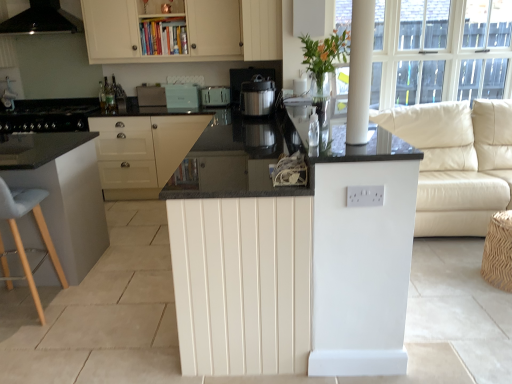
Image resolution: width=512 pixels, height=384 pixels. Identify the location of vacant point above white plastic toaster at upper center, the third appliance positioned from the right (from a real-world perspective). (148, 86).